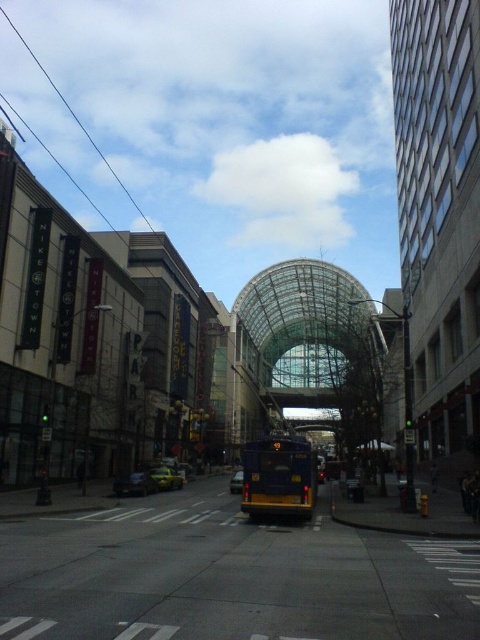
Question: Is yellow matte bus at center positioned in front of yellow matte car at center?

Choices:
 (A) yes
 (B) no

Answer: (A)

Question: Which object appears closest to the camera in this image?

Choices:
 (A) metallic silver car at lower left
 (B) yellow metallic bus at center

Answer: (B)

Question: Observing the image, what is the correct spatial positioning of yellow matte bus at center in reference to metallic silver car at lower left?

Choices:
 (A) right
 (B) left

Answer: (A)

Question: Which point appears closest to the camera in this image?

Choices:
 (A) (245, 449)
 (B) (235, 486)
 (C) (182, 474)

Answer: (A)

Question: Which point is closer to the camera?

Choices:
 (A) yellow metallic bus at center
 (B) metallic silver car at lower left

Answer: (A)

Question: Can you confirm if yellow matte bus at center is positioned to the right of yellow matte car at center?

Choices:
 (A) no
 (B) yes

Answer: (B)